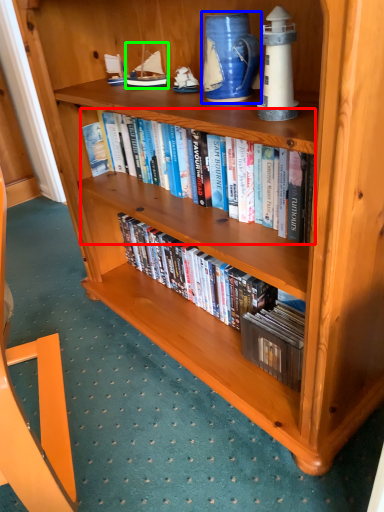
Question: Estimate the real-world distances between objects in this image. Which object is closer to book (highlighted by a red box), pitcher (highlighted by a blue box) or toy (highlighted by a green box)?

Choices:
 (A) pitcher
 (B) toy

Answer: (A)